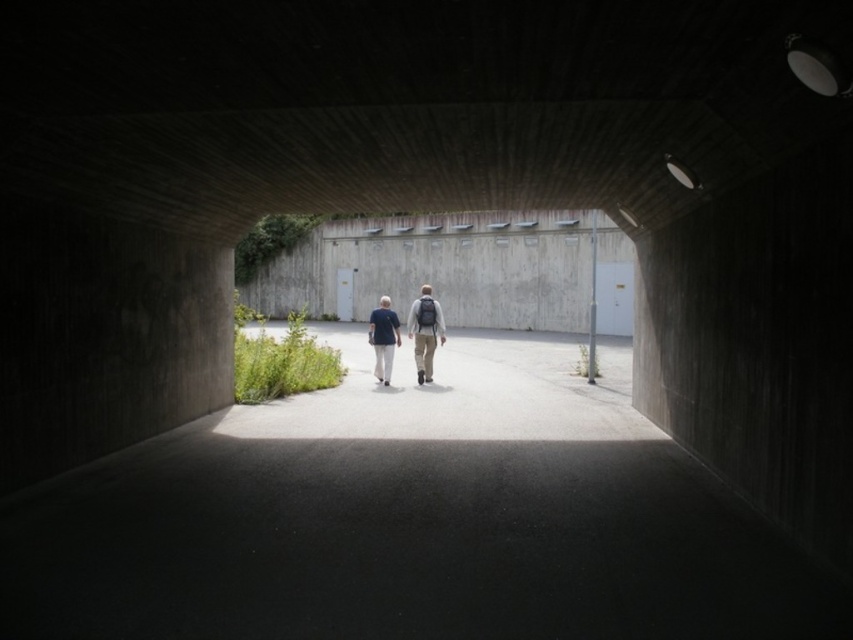
Can you confirm if light blue fabric at center is thinner than matte gray backpack at center?

In fact, light blue fabric at center might be wider than matte gray backpack at center.

From the picture: Does light blue fabric at center appear on the right side of matte gray backpack at center?

No, light blue fabric at center is not to the right of matte gray backpack at center.

The width and height of the screenshot is (853, 640). Describe the element at coordinates (425, 332) in the screenshot. I see `light blue fabric at center` at that location.

This screenshot has width=853, height=640. I want to click on light blue fabric at center, so click(425, 332).

Consider the image. Is matte gray backpack at center shorter than blue cotton shirt at center?

No, matte gray backpack at center is not shorter than blue cotton shirt at center.

Describe the element at coordinates (425, 332) in the screenshot. I see `matte gray backpack at center` at that location.

Who is more distant from viewer, (419, 310) or (392, 368)?

Positioned behind is point (392, 368).

This screenshot has height=640, width=853. In order to click on matte gray backpack at center in this screenshot , I will do `click(425, 332)`.

Does light blue fabric at center appear under blue cotton shirt at center?

Actually, light blue fabric at center is above blue cotton shirt at center.

The width and height of the screenshot is (853, 640). Describe the element at coordinates (425, 332) in the screenshot. I see `light blue fabric at center` at that location.

I want to click on light blue fabric at center, so click(425, 332).